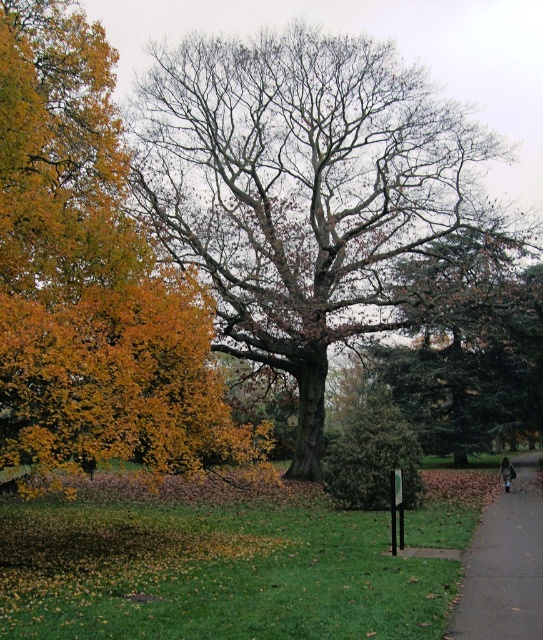
Question: Among these points, which one is farthest from the camera?

Choices:
 (A) (501, 586)
 (B) (186, 42)

Answer: (B)

Question: Is bare wood oak tree at center below gray concrete pavement at lower right?

Choices:
 (A) yes
 (B) no

Answer: (B)

Question: Which of the following is the closest to the observer?

Choices:
 (A) bare wood oak tree at center
 (B) gray concrete pavement at lower right
 (C) golden yellow leaves at left

Answer: (B)

Question: Which object is positioned closest to the bare wood oak tree at center?

Choices:
 (A) gray concrete pavement at lower right
 (B) golden yellow leaves at left

Answer: (B)

Question: Does bare wood oak tree at center appear on the right side of golden yellow leaves at left?

Choices:
 (A) yes
 (B) no

Answer: (A)

Question: Where is bare wood oak tree at center located in relation to gray concrete pavement at lower right in the image?

Choices:
 (A) right
 (B) left

Answer: (B)